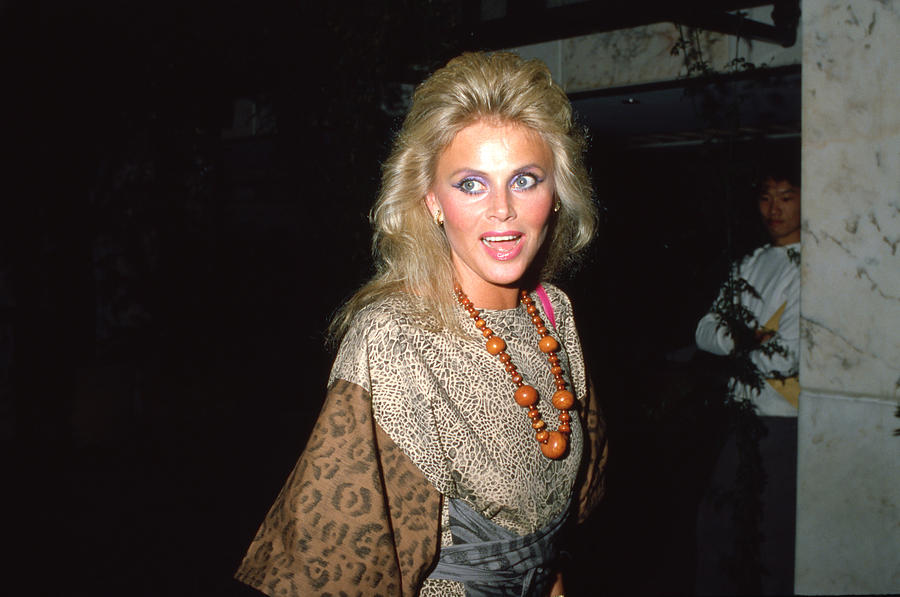
Find the location of a particular element. Image resolution: width=900 pixels, height=597 pixels. chest is located at coordinates (529, 350), (762, 270).